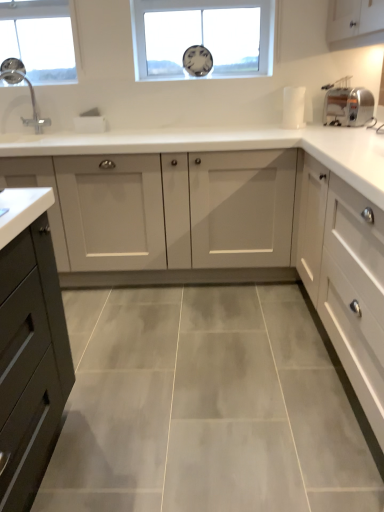
The height and width of the screenshot is (512, 384). Describe the element at coordinates (347, 104) in the screenshot. I see `satin silver toaster at right` at that location.

The height and width of the screenshot is (512, 384). In order to click on clear glass window at upper left, which ranks as the first window in left-to-right order in this screenshot , I will do `click(39, 39)`.

Locate an element on the screen. white matte cabinet at right, the second cabinetry positioned from the back is located at coordinates (344, 277).

Find the location of `transparent glass clock at upper center, which is counted as the 1th window, starting from the right`. transparent glass clock at upper center, which is counted as the 1th window, starting from the right is located at coordinates (202, 36).

Considering the positions of objects matte silver faucet at left and satin silver toaster at right in the image provided, who is more to the left, matte silver faucet at left or satin silver toaster at right?

Positioned to the left is matte silver faucet at left.

Is matte silver faucet at left outside of satin silver toaster at right?

matte silver faucet at left is positioned outside satin silver toaster at right.

Where is `tap behind the satin silver toaster at right`? tap behind the satin silver toaster at right is located at coordinates (31, 100).

Does point (33, 115) lie behind point (367, 90)?

Yes, it is.

From the picture: Does clear glass window at upper left, which ranks as the first window in left-to-right order, lie in front of white matte cabinet at right, the first cabinetry positioned from the front?

No, it is not.

Is clear glass window at upper left, which ranks as the first window in left-to-right order, smaller than white matte cabinet at right, the first cabinetry positioned from the front?

Yes, clear glass window at upper left, which ranks as the first window in left-to-right order, is smaller than white matte cabinet at right, the first cabinetry positioned from the front.

Is there a large distance between clear glass window at upper left, the 2th window positioned from the right, and white matte cabinet at right, the second cabinetry positioned from the back?

Absolutely, clear glass window at upper left, the 2th window positioned from the right, is distant from white matte cabinet at right, the second cabinetry positioned from the back.

Is clear glass window at upper left, the 2th window positioned from the right, turned away from white glossy cabinet at center, which ranks as the first cabinetry in back-to-front order?

Result: No.

From the image's perspective, which one is positioned lower, clear glass window at upper left, the 2th window positioned from the right, or white glossy cabinet at center, positioned as the 2th cabinetry in front-to-back order?

From the image's view, white glossy cabinet at center, positioned as the 2th cabinetry in front-to-back order, is below.

Is clear glass window at upper left, the 2th window positioned from the right, at the right side of white glossy cabinet at center, which ranks as the first cabinetry in back-to-front order?

Incorrect, clear glass window at upper left, the 2th window positioned from the right, is not on the right side of white glossy cabinet at center, which ranks as the first cabinetry in back-to-front order.

Considering the relative sizes of clear glass window at upper left, the 2th window positioned from the right, and white glossy cabinet at center, positioned as the 2th cabinetry in front-to-back order, in the image provided, is clear glass window at upper left, the 2th window positioned from the right, bigger than white glossy cabinet at center, positioned as the 2th cabinetry in front-to-back order,?

Actually, clear glass window at upper left, the 2th window positioned from the right, might be smaller than white glossy cabinet at center, positioned as the 2th cabinetry in front-to-back order.

Is transparent glass clock at upper center, which is the second window from left to right, at the back of clear glass window at upper left, which ranks as the first window in left-to-right order?

No, clear glass window at upper left, which ranks as the first window in left-to-right order, is not facing the opposite direction of transparent glass clock at upper center, which is the second window from left to right.

Considering the relative sizes of clear glass window at upper left, which ranks as the first window in left-to-right order, and transparent glass clock at upper center, which is counted as the 1th window, starting from the right, in the image provided, is clear glass window at upper left, which ranks as the first window in left-to-right order, taller than transparent glass clock at upper center, which is counted as the 1th window, starting from the right,?

Yes.

How many degrees apart are the facing directions of clear glass window at upper left, which ranks as the first window in left-to-right order, and transparent glass clock at upper center, which is counted as the 1th window, starting from the right?

The angle between the facing direction of clear glass window at upper left, which ranks as the first window in left-to-right order, and the facing direction of transparent glass clock at upper center, which is counted as the 1th window, starting from the right, is 0.000628 degrees.

Find the location of a particular element. The width and height of the screenshot is (384, 512). appliance that appears in front of the clear glass window at upper left, which ranks as the first window in left-to-right order is located at coordinates (347, 104).

Is satin silver toaster at right far from clear glass window at upper left, the 2th window positioned from the right?

Yes, satin silver toaster at right is far from clear glass window at upper left, the 2th window positioned from the right.

From the image's perspective, is satin silver toaster at right located above or below clear glass window at upper left, the 2th window positioned from the right?

satin silver toaster at right is below clear glass window at upper left, the 2th window positioned from the right.

The width and height of the screenshot is (384, 512). Identify the location of window on the left of white glossy cabinet at center, which ranks as the first cabinetry in back-to-front order. (39, 39).

Is white glossy cabinet at center, positioned as the 2th cabinetry in front-to-back order, touching clear glass window at upper left, which ranks as the first window in left-to-right order?

No, white glossy cabinet at center, positioned as the 2th cabinetry in front-to-back order, is not touching clear glass window at upper left, which ranks as the first window in left-to-right order.

From the image's perspective, which one is positioned higher, white glossy cabinet at center, which ranks as the first cabinetry in back-to-front order, or clear glass window at upper left, which ranks as the first window in left-to-right order?

clear glass window at upper left, which ranks as the first window in left-to-right order, is shown above in the image.

Considering the positions of objects white glossy cabinet at center, which ranks as the first cabinetry in back-to-front order, and clear glass window at upper left, the 2th window positioned from the right, in the image provided, who is more to the left, white glossy cabinet at center, which ranks as the first cabinetry in back-to-front order, or clear glass window at upper left, the 2th window positioned from the right,?

From the viewer's perspective, clear glass window at upper left, the 2th window positioned from the right, appears more on the left side.

Which of these two, clear glass window at upper left, which ranks as the first window in left-to-right order, or matte silver faucet at left, is smaller?

With smaller size is matte silver faucet at left.

Is point (34, 33) positioned behind point (6, 76)?

Yes, point (34, 33) is farther from viewer.

Starting from the matte silver faucet at left, which window is the 1st one to the right? Please provide its 2D coordinates.

[(39, 39)]

Find the location of `tap above the satin silver toaster at right (from a real-world perspective)`. tap above the satin silver toaster at right (from a real-world perspective) is located at coordinates (31, 100).

This screenshot has height=512, width=384. I want to click on window that is the 2nd object to the left of the white matte cabinet at right, the first cabinetry positioned from the front, starting at the anchor, so click(x=39, y=39).

When comparing their distances from white matte cabinet at right, the first cabinetry positioned from the front, does clear glass window at upper left, the 2th window positioned from the right, or transparent glass clock at upper center, which is counted as the 1th window, starting from the right, seem further?

clear glass window at upper left, the 2th window positioned from the right, lies further to white matte cabinet at right, the first cabinetry positioned from the front, than the other object.

Which object lies nearer to the anchor point matte silver faucet at left, satin silver toaster at right or transparent glass clock at upper center, which is the second window from left to right?

transparent glass clock at upper center, which is the second window from left to right, lies closer to matte silver faucet at left than the other object.

When comparing their distances from white matte cabinet at right, the first cabinetry positioned from the front, does matte silver faucet at left or clear glass window at upper left, the 2th window positioned from the right, seem closer?

matte silver faucet at left is closer to white matte cabinet at right, the first cabinetry positioned from the front.

From the image, which object appears to be farther from white matte cabinet at right, the first cabinetry positioned from the front, matte silver faucet at left or transparent glass clock at upper center, which is the second window from left to right?

matte silver faucet at left.

Based on their spatial positions, is clear glass window at upper left, the 2th window positioned from the right, or white matte cabinet at right, the second cabinetry positioned from the back, further from matte silver faucet at left?

white matte cabinet at right, the second cabinetry positioned from the back, is positioned further to the anchor matte silver faucet at left.

Estimate the real-world distances between objects in this image. Which object is closer to matte silver faucet at left, white matte cabinet at right, the second cabinetry positioned from the back, or satin silver toaster at right?

satin silver toaster at right is positioned closer to the anchor matte silver faucet at left.

Looking at the image, which one is located further to white glossy cabinet at center, which ranks as the first cabinetry in back-to-front order, matte silver faucet at left or clear glass window at upper left, the 2th window positioned from the right?

The object further to white glossy cabinet at center, which ranks as the first cabinetry in back-to-front order, is clear glass window at upper left, the 2th window positioned from the right.

Estimate the real-world distances between objects in this image. Which object is further from transparent glass clock at upper center, which is counted as the 1th window, starting from the right, white glossy cabinet at center, positioned as the 2th cabinetry in front-to-back order, or matte silver faucet at left?

The object further to transparent glass clock at upper center, which is counted as the 1th window, starting from the right, is matte silver faucet at left.

Find the location of a particular element. tap between white matte cabinet at right, the second cabinetry positioned from the back, and transparent glass clock at upper center, which is counted as the 1th window, starting from the right, in the front-back direction is located at coordinates (31, 100).

Identify the location of cabinetry located between white matte cabinet at right, the first cabinetry positioned from the front, and transparent glass clock at upper center, which is counted as the 1th window, starting from the right, in the depth direction. (167, 216).

Image resolution: width=384 pixels, height=512 pixels. Identify the location of appliance located between white matte cabinet at right, the first cabinetry positioned from the front, and transparent glass clock at upper center, which is the second window from left to right, in the depth direction. (347, 104).

You are a GUI agent. You are given a task and a screenshot of the screen. Output one action in this format:
    pyautogui.click(x=<x>, y=<y>)
    Task: Click on the window between white matte cabinet at right, the first cabinetry positioned from the front, and clear glass window at upper left, which ranks as the first window in left-to-right order, along the z-axis
    The width and height of the screenshot is (384, 512).
    Given the screenshot: What is the action you would take?
    pyautogui.click(x=202, y=36)